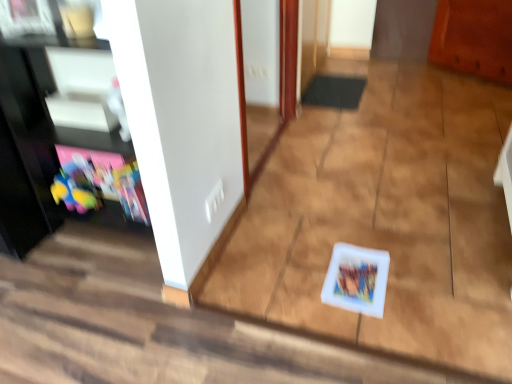
Locate an element on the screen. The height and width of the screenshot is (384, 512). free space to the right of white matte card game at center is located at coordinates (416, 277).